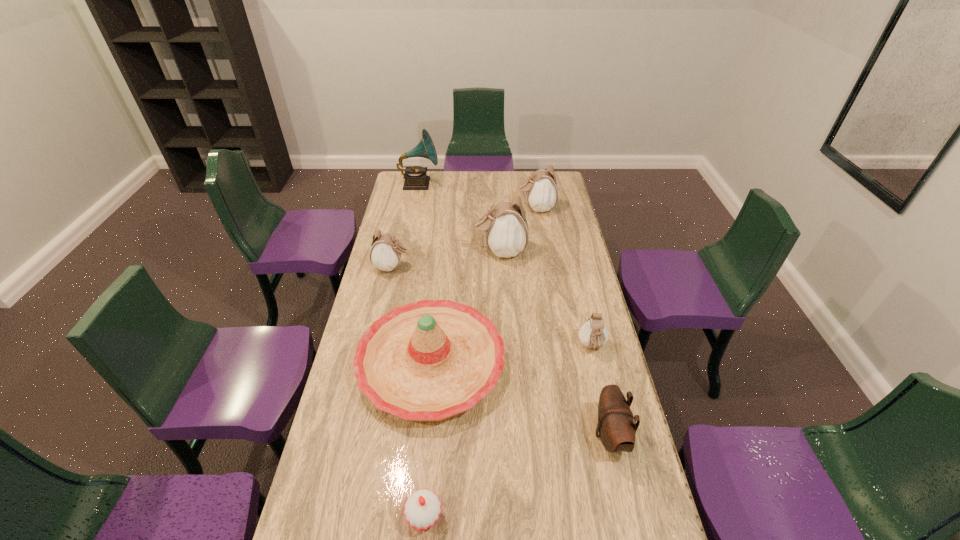
You are a GUI agent. You are given a task and a screenshot of the screen. Output one action in this format:
    pyautogui.click(x=<x>, y=<y>)
    Task: Click on the farthest object
    The width and height of the screenshot is (960, 540).
    Given the screenshot: What is the action you would take?
    pyautogui.click(x=416, y=178)

The image size is (960, 540). Find the location of `the tallest pouch`. the tallest pouch is located at coordinates (506, 229).

Where is `the farthest pouch`? the farthest pouch is located at coordinates (541, 189).

Image resolution: width=960 pixels, height=540 pixels. I want to click on the second tallest pouch, so click(541, 189).

You are a GUI agent. You are given a task and a screenshot of the screen. Output one action in this format:
    pyautogui.click(x=<x>, y=<y>)
    Task: Click on the red sombrero
    The height and width of the screenshot is (540, 960).
    Given the screenshot: What is the action you would take?
    pyautogui.click(x=429, y=360)

At what (x,y) coordinates should I click in order to perform the action: click on the third biggest white pouch. Please return your answer as a coordinate pair (x, y). This screenshot has height=540, width=960. Looking at the image, I should click on (385, 254).

I want to click on the leftmost pouch, so click(385, 254).

Where is `brown pouch`? brown pouch is located at coordinates (617, 426).

Identify the location of the fourth farthest pouch. (593, 334).

The width and height of the screenshot is (960, 540). What are the coordinates of `the second shortest object` in the screenshot? It's located at (593, 334).